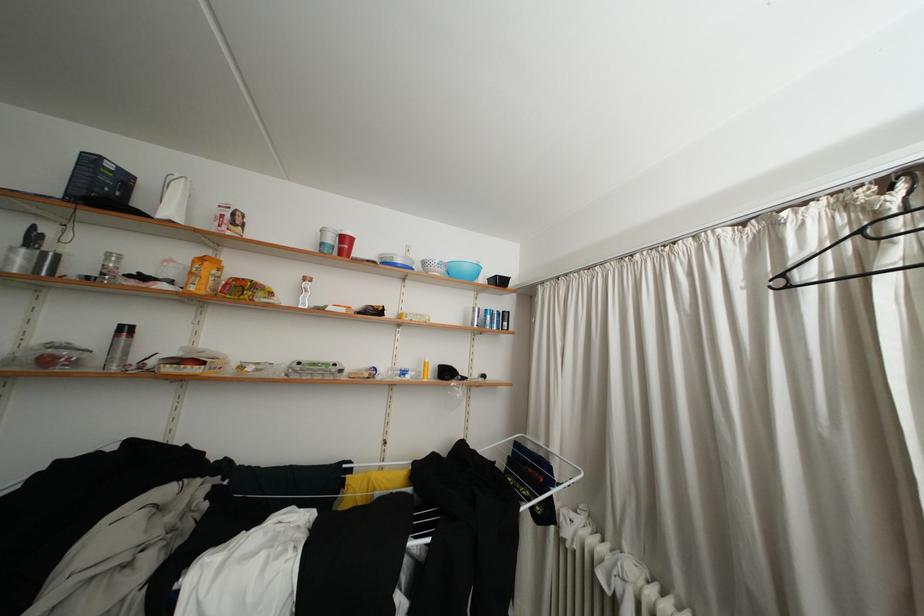
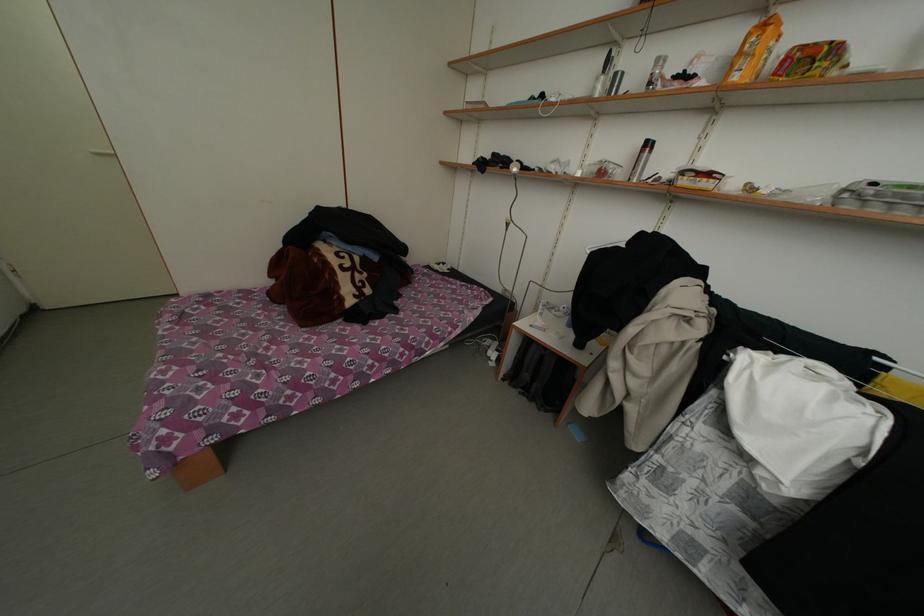
The first image is from the beginning of the video and the second image is from the end. How did the camera likely rotate when shooting the video?

The camera rotated toward left-down.